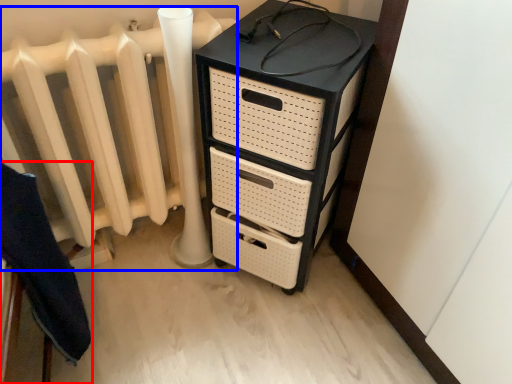
Question: Which point is closer to the camera, furniture (highlighted by a red box) or radiator (highlighted by a blue box)?

Choices:
 (A) furniture
 (B) radiator

Answer: (A)